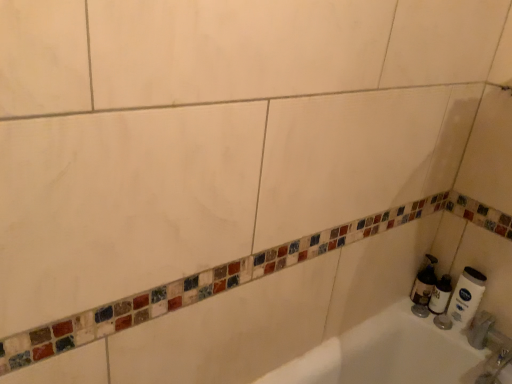
Question: Considering the positions of white matte tube at right, which appears as the 1th toilet paper when viewed from the right, and translucent plastic soap dispenser at lower right in the image, is white matte tube at right, which appears as the 1th toilet paper when viewed from the right, wider or thinner than translucent plastic soap dispenser at lower right?

Choices:
 (A) wide
 (B) thin

Answer: (B)

Question: Considering the positions of white matte tube at right, which appears as the 1th toilet paper when viewed from the right, and translucent plastic soap dispenser at lower right in the image, is white matte tube at right, which appears as the 1th toilet paper when viewed from the right, taller or shorter than translucent plastic soap dispenser at lower right?

Choices:
 (A) short
 (B) tall

Answer: (B)

Question: Which of these objects is positioned farthest from the translucent plastic soap dispenser at lower right?

Choices:
 (A) white matte toilet paper at right, which ranks as the first toilet paper in left-to-right order
 (B) white matte tube at right, which appears as the 1th toilet paper when viewed from the right

Answer: (B)

Question: Which of these objects is positioned closest to the white matte toilet paper at right, which ranks as the first toilet paper in left-to-right order?

Choices:
 (A) white matte tube at right, which appears as the 1th toilet paper when viewed from the right
 (B) translucent plastic soap dispenser at lower right

Answer: (B)